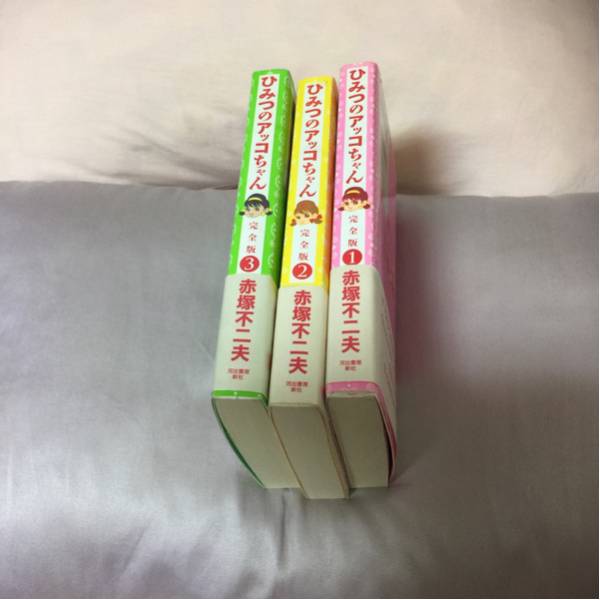
At what (x,y) coordinates should I click in order to perform the action: click on pink white and red book spine. Please return your answer as a coordinate pair (x, y). Looking at the image, I should click on (369, 238).